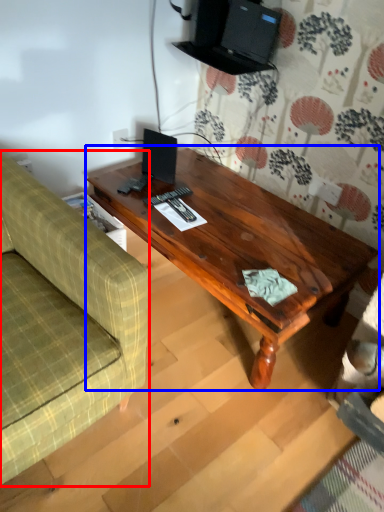
Question: Which of the following is the farthest to the observer, studio couch (highlighted by a red box) or coffee table (highlighted by a blue box)?

Choices:
 (A) studio couch
 (B) coffee table

Answer: (B)